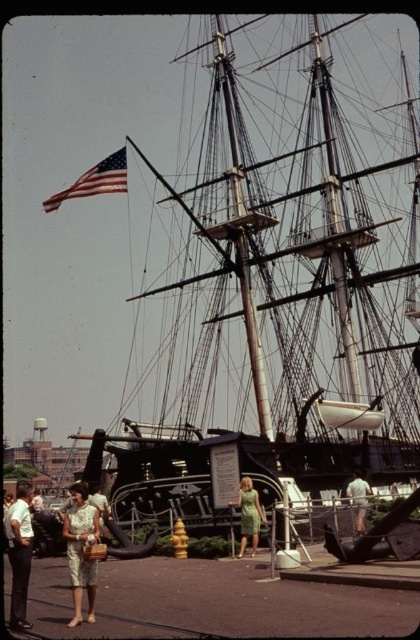
You are a photographer standing at the base of the ship, wanting to capture both the american flag at upper left and the white fabric shirt at center in the same frame. Given that your camera has a maximum focal length that allows capturing objects up to 200 feet apart, will you be able to include both in your shot?

The american flag at upper left and white fabric shirt at center are 200.42 feet apart, which exceeds the camera maximum focal length of 200 feet. Therefore, you cannot capture both in the same frame.

You are a tour guide explaining the historical ship to visitors. You notice a visitor pointing at the light beige pants at lower left and the american flag at upper left. Can you tell them which object is closer to the visitors?

The light beige pants at lower left is in front of the american flag at upper left, so it is closer to the visitors.

You are standing at the point closest to the ship in the image. Which point, point [21,509] or point [58,195], is closer to the ship?

Point [21,509] is in front of point [58,195], so it is closer to the ship.